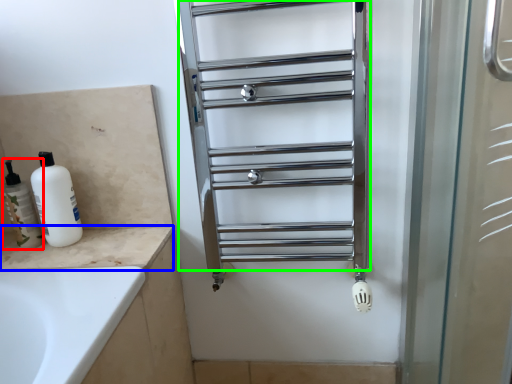
Question: Estimate the real-world distances between objects in this image. Which object is farther from toiletry (highlighted by a red box), counter top (highlighted by a blue box) or cage (highlighted by a green box)?

Choices:
 (A) counter top
 (B) cage

Answer: (B)